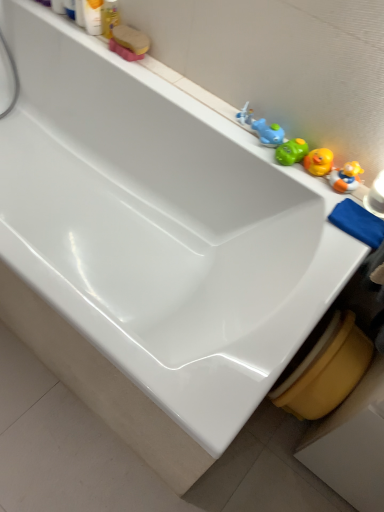
Question: Is matte plastic soap at upper left, which is counted as the 1th toiletry, starting from the right, taller than blue cloth at right?

Choices:
 (A) yes
 (B) no

Answer: (A)

Question: Can you confirm if matte plastic soap at upper left, which is counted as the 1th toiletry, starting from the right, is bigger than blue cloth at right?

Choices:
 (A) yes
 (B) no

Answer: (B)

Question: Is matte plastic soap at upper left, which is counted as the 1th toiletry, starting from the right, to the right of blue cloth at right from the viewer's perspective?

Choices:
 (A) no
 (B) yes

Answer: (A)

Question: Is matte plastic soap at upper left, which is counted as the 1th toiletry, starting from the right, with blue cloth at right?

Choices:
 (A) no
 (B) yes

Answer: (A)

Question: Is blue cloth at right at the back of matte plastic soap at upper left, which is counted as the 1th toiletry, starting from the right?

Choices:
 (A) yes
 (B) no

Answer: (B)

Question: From the image's perspective, is matte plastic soap at upper left, which is counted as the 1th toiletry, starting from the right, beneath blue cloth at right?

Choices:
 (A) yes
 (B) no

Answer: (B)

Question: Is matte plastic bottle at upper left, which ranks as the 2th toiletry in right-to-left order, touching blue rubber duck at upper right, which appears as the 3th toy when viewed from the top?

Choices:
 (A) yes
 (B) no

Answer: (B)

Question: Considering the relative sizes of matte plastic bottle at upper left, arranged as the first toiletry when viewed from the left, and blue rubber duck at upper right, placed as the 2th toy when sorted from bottom to top, in the image provided, is matte plastic bottle at upper left, arranged as the first toiletry when viewed from the left, bigger than blue rubber duck at upper right, placed as the 2th toy when sorted from bottom to top,?

Choices:
 (A) yes
 (B) no

Answer: (A)

Question: Does matte plastic bottle at upper left, arranged as the first toiletry when viewed from the left, appear on the right side of blue rubber duck at upper right, which ranks as the third toy in left-to-right order?

Choices:
 (A) yes
 (B) no

Answer: (B)

Question: From the image's perspective, is matte plastic bottle at upper left, arranged as the first toiletry when viewed from the left, under blue rubber duck at upper right, which ranks as the third toy in left-to-right order?

Choices:
 (A) no
 (B) yes

Answer: (A)

Question: From a real-world perspective, is matte plastic bottle at upper left, which ranks as the 2th toiletry in right-to-left order, below blue rubber duck at upper right, placed as the 2th toy when sorted from bottom to top?

Choices:
 (A) no
 (B) yes

Answer: (A)

Question: Would you say matte plastic bottle at upper left, which ranks as the 2th toiletry in right-to-left order, is outside blue rubber duck at upper right, which ranks as the third toy in left-to-right order?

Choices:
 (A) no
 (B) yes

Answer: (B)

Question: From the image's perspective, is blue rubber duck at upper right, placed as the 2th toy when sorted from bottom to top, below white plastic toy at upper right, the third toy when ordered from bottom to top?

Choices:
 (A) yes
 (B) no

Answer: (A)